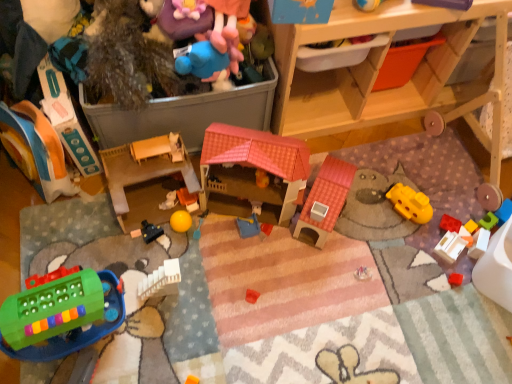
Locate an element on the screen. The image size is (512, 384). vacant area to the left of smooth plastic toy at center, arranged as the 5th toy when viewed from the left is located at coordinates (126, 211).